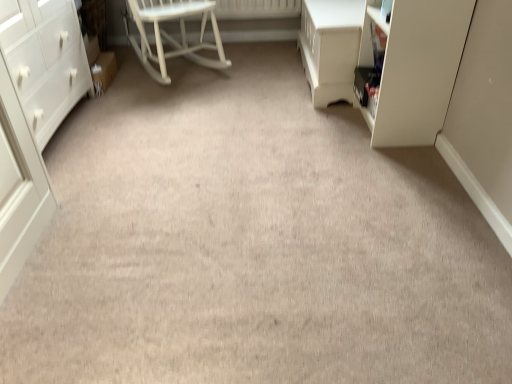
What are the coordinates of `free area below white wood rocking chair at center (from a real-world perspective)` in the screenshot? It's located at (176, 65).